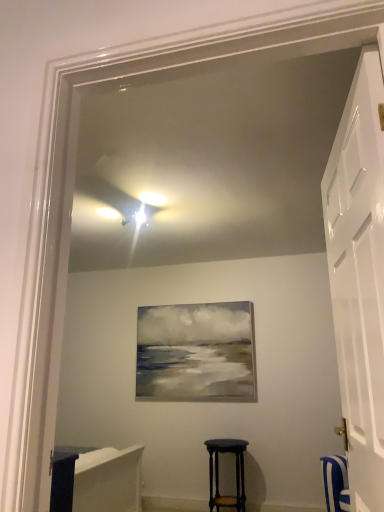
This screenshot has width=384, height=512. What do you see at coordinates (359, 277) in the screenshot? I see `white glossy door at right` at bounding box center [359, 277].

Identify the location of white glossy door at right. (359, 277).

Find the location of a particular element. The height and width of the screenshot is (512, 384). dark wood stool at center is located at coordinates (218, 472).

What is the approximate height of dark wood stool at center?

25.05 inches.

In order to face dark wood stool at center, should I rotate leftwards or rightwards?

Rotate your view right by about 4.875°.

What do you see at coordinates (218, 472) in the screenshot?
I see `dark wood stool at center` at bounding box center [218, 472].

You are a GUI agent. You are given a task and a screenshot of the screen. Output one action in this format:
    pyautogui.click(x=<x>, y=<y>)
    Task: Click on the white glossy door at right
    
    Given the screenshot: What is the action you would take?
    pyautogui.click(x=359, y=277)

Does dark wood stool at center appear on the right side of white glossy door at right?

No.

Is dark wood stool at center behind white glossy door at right?

Yes, the depth of dark wood stool at center is greater than that of white glossy door at right.

Considering the positions of point (211, 462) and point (365, 448), is point (211, 462) closer or farther from the camera than point (365, 448)?

Point (211, 462) is positioned farther from the camera compared to point (365, 448).

From the image's perspective, does dark wood stool at center appear higher than white glossy door at right?

No, from the image's perspective, dark wood stool at center is not on top of white glossy door at right.

From a real-world perspective, is dark wood stool at center under white glossy door at right?

Yes.

Which object is wider, dark wood stool at center or white glossy door at right?

With larger width is dark wood stool at center.

From their relative heights in the image, would you say dark wood stool at center is taller or shorter than white glossy door at right?

Clearly, dark wood stool at center is shorter compared to white glossy door at right.

Is dark wood stool at center smaller than white glossy door at right?

Yes, dark wood stool at center is smaller than white glossy door at right.

Is dark wood stool at center spatially inside white glossy door at right, or outside of it?

dark wood stool at center is not inside white glossy door at right, it's outside.

Can you see dark wood stool at center touching white glossy door at right?

They are not placed beside each other.

Is dark wood stool at center oriented away from white glossy door at right?

No, dark wood stool at center is not facing away from white glossy door at right.

How many degrees apart are the facing directions of dark wood stool at center and white glossy door at right?

dark wood stool at center and white glossy door at right are facing 85.1 degrees away from each other.

How much distance is there between dark wood stool at center and white glossy door at right?

They are 8.93 feet apart.

Locate an element on the screen. The image size is (384, 512). stool behind the white glossy door at right is located at coordinates (218, 472).

In the image, is white glossy door at right on the left side or the right side of dark wood stool at center?

Clearly, white glossy door at right is on the right of dark wood stool at center in the image.

From the picture: Between white glossy door at right and dark wood stool at center, which one is positioned in front?

white glossy door at right is in front.

Between point (346, 419) and point (217, 492), which one is positioned in front?

The point (346, 419) is more forward.

From the image's perspective, does white glossy door at right appear higher than dark wood stool at center?

Indeed, from the image's perspective, white glossy door at right is shown above dark wood stool at center.

From a real-world perspective, is white glossy door at right under dark wood stool at center?

No, from a real-world perspective, white glossy door at right is not under dark wood stool at center.

Does white glossy door at right have a lesser width compared to dark wood stool at center?

Indeed, white glossy door at right has a lesser width compared to dark wood stool at center.

Can you confirm if white glossy door at right is taller than dark wood stool at center?

Correct, white glossy door at right is much taller as dark wood stool at center.

Considering the relative sizes of white glossy door at right and dark wood stool at center in the image provided, is white glossy door at right smaller than dark wood stool at center?

Incorrect, white glossy door at right is not smaller in size than dark wood stool at center.

Is white glossy door at right spatially inside dark wood stool at center, or outside of it?

white glossy door at right cannot be found inside dark wood stool at center.

Is white glossy door at right far from dark wood stool at center?

white glossy door at right is positioned a significant distance from dark wood stool at center.

From the picture: Does white glossy door at right turn towards dark wood stool at center?

No, white glossy door at right is not aimed at dark wood stool at center.

You are a GUI agent. You are given a task and a screenshot of the screen. Output one action in this format:
    pyautogui.click(x=<x>, y=<y>)
    Task: Click on the door that appears above the dark wood stool at center (from a real-world perspective)
    
    Given the screenshot: What is the action you would take?
    pyautogui.click(x=359, y=277)

Find the location of a particular element. door on the right of dark wood stool at center is located at coordinates (359, 277).

Find the location of a particular element. The image size is (384, 512). stool on the left of the white glossy door at right is located at coordinates (218, 472).